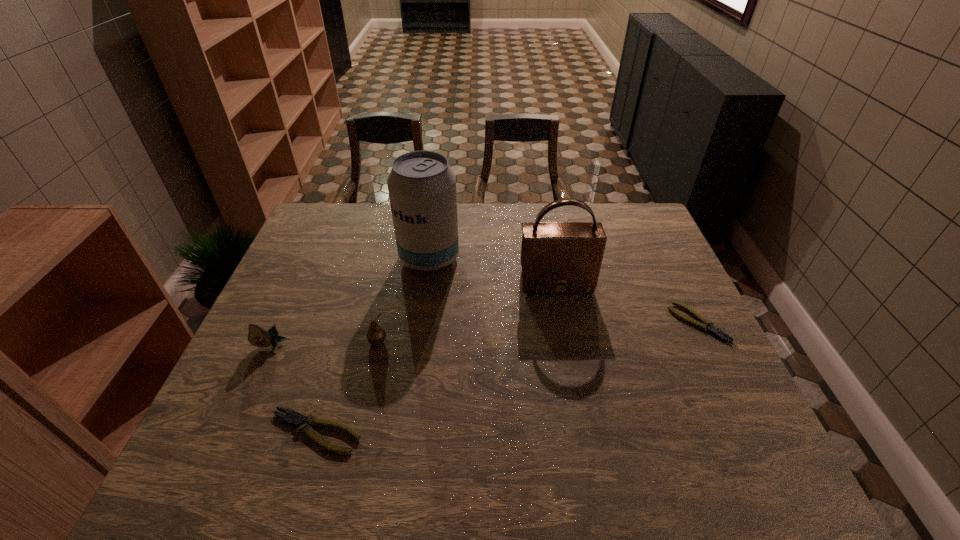
To ensure equal spacing by inserting another pliers among them, please point out a vacant spot for this new pliers. Please provide its 2D coordinates. Your answer should be formatted as a tuple, i.e. [(x, y)], where the tuple contains the x and y coordinates of a point satisfying the conditions above.

[(527, 371)]